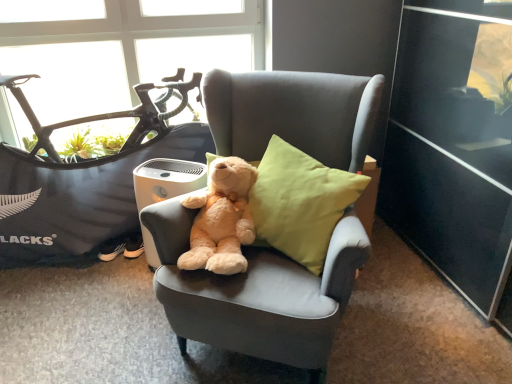
Question: Is light brown plush teddy bear at center facing towards transparent glass window at upper left?

Choices:
 (A) yes
 (B) no

Answer: (B)

Question: Is light brown plush teddy bear at center at the right side of transparent glass window at upper left?

Choices:
 (A) no
 (B) yes

Answer: (B)

Question: From a real-world perspective, is light brown plush teddy bear at center physically below transparent glass window at upper left?

Choices:
 (A) no
 (B) yes

Answer: (B)

Question: Does light brown plush teddy bear at center come behind transparent glass window at upper left?

Choices:
 (A) no
 (B) yes

Answer: (A)

Question: Is light brown plush teddy bear at center positioned with its back to transparent glass window at upper left?

Choices:
 (A) no
 (B) yes

Answer: (B)

Question: From the image's perspective, is transparent glass window at upper left positioned above or below light brown plush teddy bear at center?

Choices:
 (A) above
 (B) below

Answer: (A)

Question: Do you think transparent glass window at upper left is within light brown plush teddy bear at center, or outside of it?

Choices:
 (A) outside
 (B) inside

Answer: (A)

Question: In the image, is transparent glass window at upper left on the left side or the right side of light brown plush teddy bear at center?

Choices:
 (A) left
 (B) right

Answer: (A)

Question: From a real-world perspective, is transparent glass window at upper left above or below light brown plush teddy bear at center?

Choices:
 (A) above
 (B) below

Answer: (A)

Question: Is soft gray fabric chair at center inside or outside of linen cushion at center, the second pillow positioned from the left?

Choices:
 (A) outside
 (B) inside

Answer: (A)

Question: From a real-world perspective, is soft gray fabric chair at center physically located above or below linen cushion at center, the second pillow positioned from the left?

Choices:
 (A) above
 (B) below

Answer: (B)

Question: Based on their positions, is soft gray fabric chair at center located to the left or right of linen cushion at center, acting as the 1th pillow starting from the right?

Choices:
 (A) left
 (B) right

Answer: (A)

Question: Is soft gray fabric chair at center in front of or behind linen cushion at center, acting as the 1th pillow starting from the right, in the image?

Choices:
 (A) behind
 (B) front

Answer: (B)

Question: From a real-world perspective, is linen-like green pillow at center, which is counted as the 1th pillow, starting from the left, physically located above or below transparent glass window at upper left?

Choices:
 (A) below
 (B) above

Answer: (A)

Question: From their relative heights in the image, would you say linen-like green pillow at center, which is counted as the 1th pillow, starting from the left, is taller or shorter than transparent glass window at upper left?

Choices:
 (A) tall
 (B) short

Answer: (B)